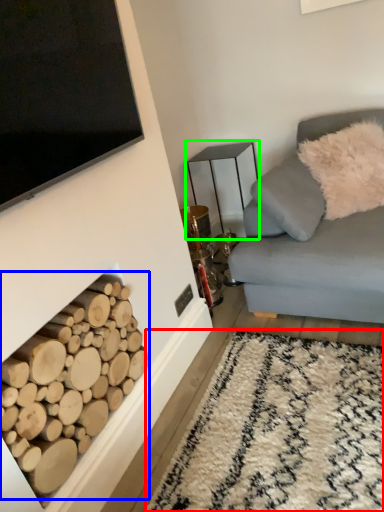
Question: Which is nearer to the plain (highlighted by a red box)? driftwood (highlighted by a blue box) or table (highlighted by a green box).

Choices:
 (A) driftwood
 (B) table

Answer: (A)